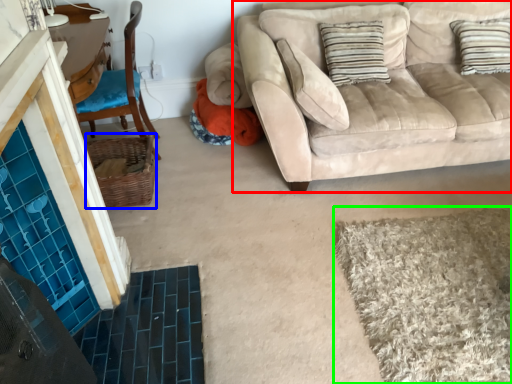
Question: Considering the real-world distances, which object is closest to studio couch (highlighted by a red box)? basket (highlighted by a blue box) or bath mat (highlighted by a green box).

Choices:
 (A) basket
 (B) bath mat

Answer: (B)